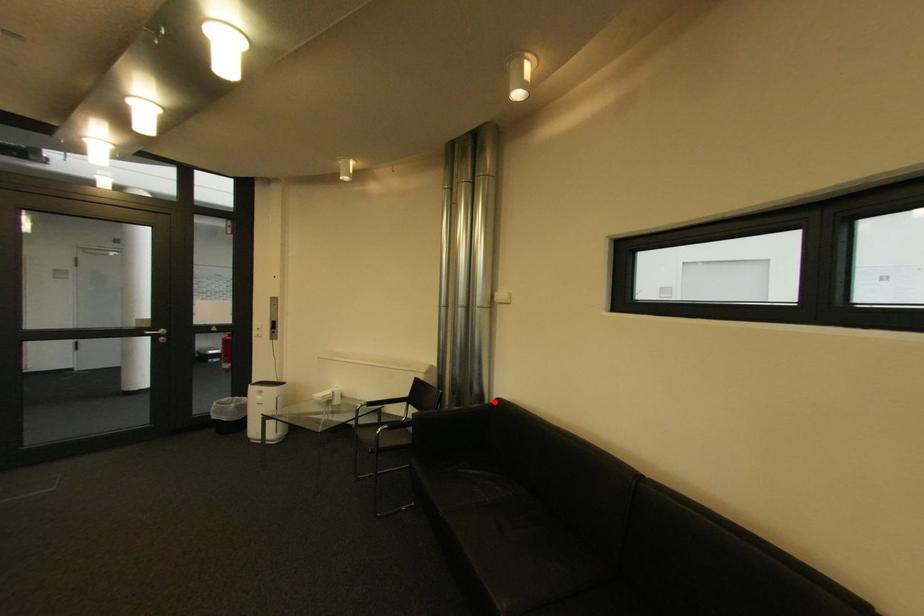
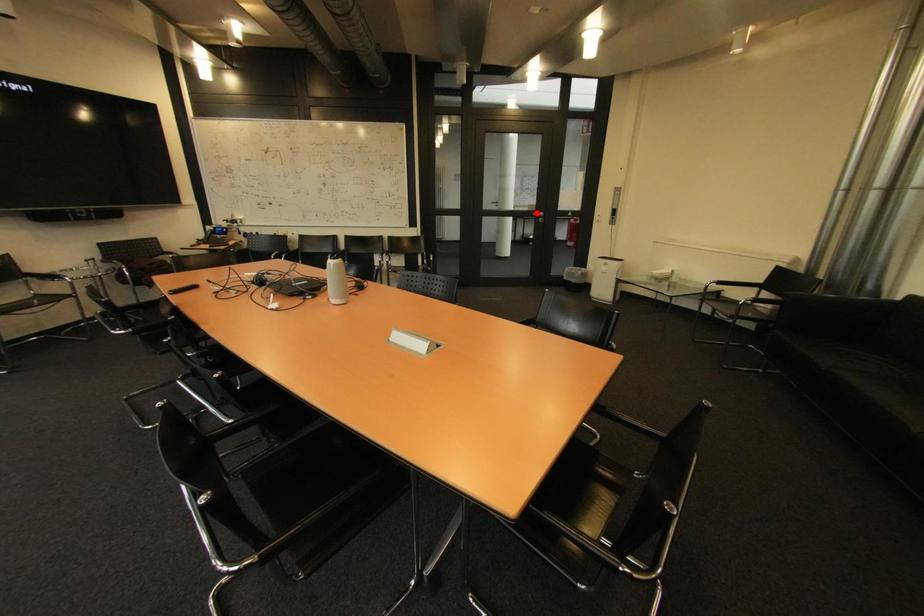
I am providing you with two images of the same scene from different viewpoints. A red point is marked on the first image and another point is marked on the second image. Is the marked point in image1 the same physical position as the marked point in image2?

No